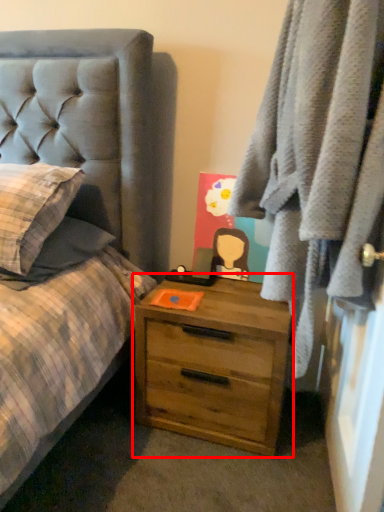
Question: From the image, what is the correct spatial relationship of chest of drawers (annotated by the red box) in relation to clothing?

Choices:
 (A) right
 (B) left

Answer: (B)